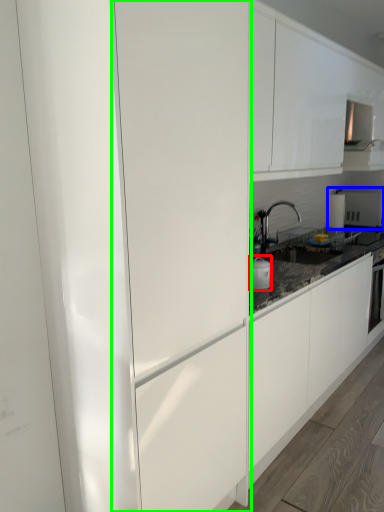
Question: Based on their relative distances, which object is farther from appliance (highlighted by a red box)? Choose from appliance (highlighted by a blue box) and glass door (highlighted by a green box).

Choices:
 (A) appliance
 (B) glass door

Answer: (A)